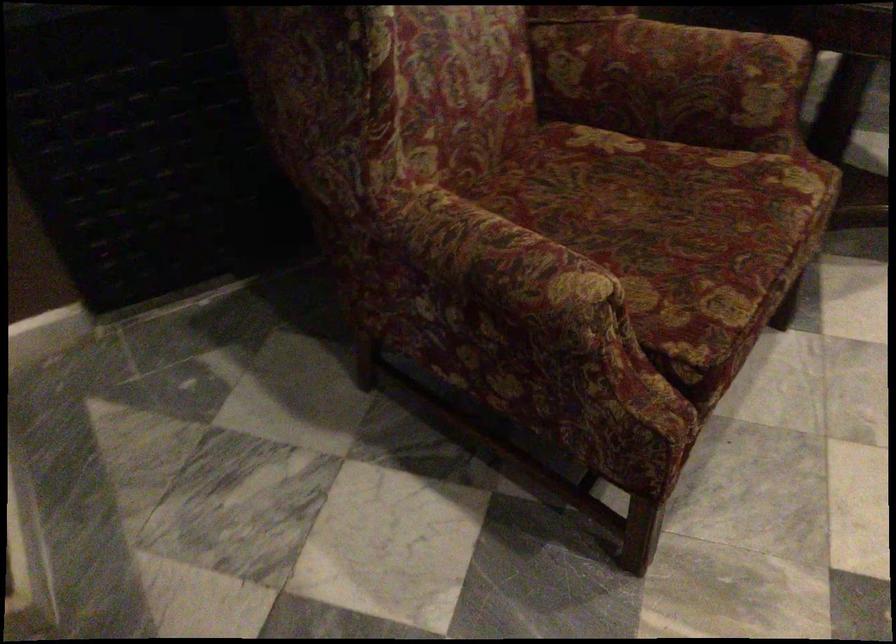
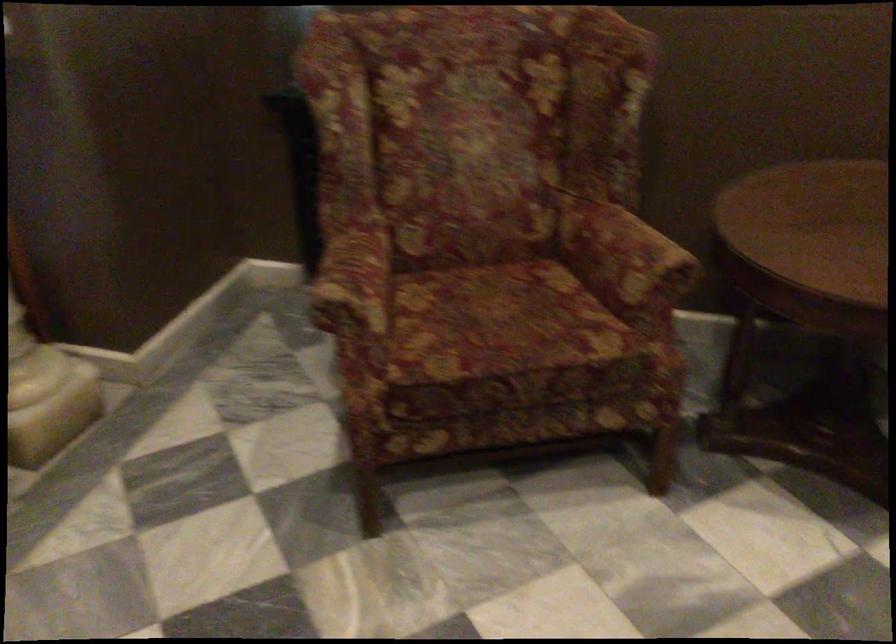
Where in the second image is the point corresponding to the point at 724,77 from the first image?

(624, 258)